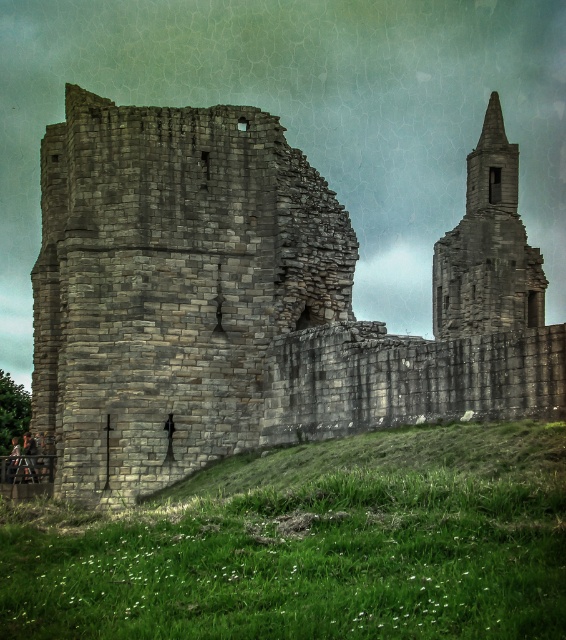
Can you confirm if gray stone castle at left is taller than green grassy at lower center?

Correct, gray stone castle at left is much taller as green grassy at lower center.

Can you confirm if gray stone castle at left is wider than green grassy at lower center?

Correct, the width of gray stone castle at left exceeds that of green grassy at lower center.

Is point (126, 189) farther from viewer compared to point (381, 620)?

Yes, it is behind point (381, 620).

The width and height of the screenshot is (566, 640). What are the coordinates of `gray stone castle at left` in the screenshot? It's located at (254, 300).

Does gray stone castle at left appear on the left side of gray stone tower at upper right?

Indeed, gray stone castle at left is positioned on the left side of gray stone tower at upper right.

Which is below, gray stone castle at left or gray stone tower at upper right?

gray stone castle at left

Describe the element at coordinates (254, 300) in the screenshot. I see `gray stone castle at left` at that location.

Locate an element on the screen. The image size is (566, 640). gray stone castle at left is located at coordinates (254, 300).

Is green grassy at lower center positioned in front of gray stone tower at upper right?

Yes, it is.

Which is more to the right, green grassy at lower center or gray stone tower at upper right?

gray stone tower at upper right is more to the right.

At what (x,y) coordinates should I click in order to perform the action: click on green grassy at lower center. Please return your answer as a coordinate pair (x, y). Looking at the image, I should click on (311, 545).

The width and height of the screenshot is (566, 640). Identify the location of green grassy at lower center. (311, 545).